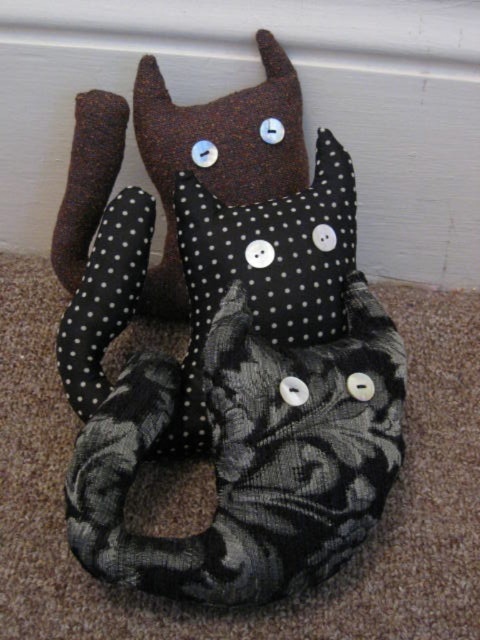
Can you confirm if black dotted fabric cat at center is wider than black dotted fabric pillow at center?

Correct, the width of black dotted fabric cat at center exceeds that of black dotted fabric pillow at center.

Is black dotted fabric cat at center taller than black dotted fabric pillow at center?

Yes, black dotted fabric cat at center is taller than black dotted fabric pillow at center.

Find the location of `black dotted fabric cat at center`. black dotted fabric cat at center is located at coordinates (226, 342).

Locate an element on the screen. The height and width of the screenshot is (640, 480). black dotted fabric cat at center is located at coordinates (226, 342).